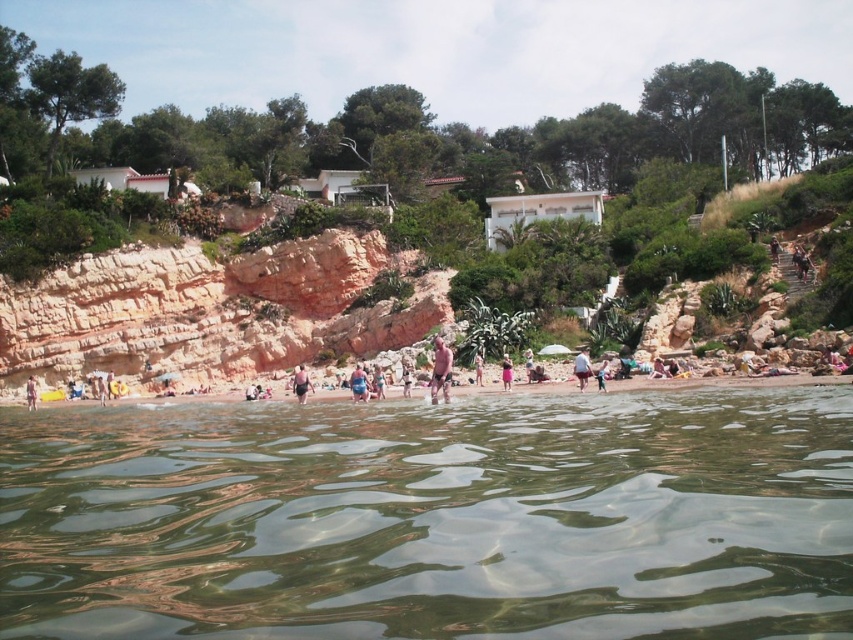
Measure the distance between green translucent water at center and smooth tan skin at upper right.

They are 48.79 meters apart.

Can you confirm if green translucent water at center is taller than smooth tan skin at upper right?

Yes, green translucent water at center is taller than smooth tan skin at upper right.

The image size is (853, 640). In order to click on green translucent water at center in this screenshot , I will do `click(432, 518)`.

Measure the distance between rustic stone cliff at center and smooth tan skin at center.

rustic stone cliff at center is 15.84 meters from smooth tan skin at center.

Who is higher up, rustic stone cliff at center or smooth tan skin at center?

rustic stone cliff at center is higher up.

Between point (3, 374) and point (300, 400), which one is positioned in front?

Point (300, 400) is more forward.

Identify the location of rustic stone cliff at center. (209, 310).

Between rustic stone cliff at center and smooth tan skin at upper right, which one appears on the left side from the viewer's perspective?

From the viewer's perspective, rustic stone cliff at center appears more on the left side.

Who is shorter, rustic stone cliff at center or smooth tan skin at upper right?

Standing shorter between the two is smooth tan skin at upper right.

What do you see at coordinates (209, 310) in the screenshot? I see `rustic stone cliff at center` at bounding box center [209, 310].

Identify the location of rustic stone cliff at center. Image resolution: width=853 pixels, height=640 pixels. (209, 310).